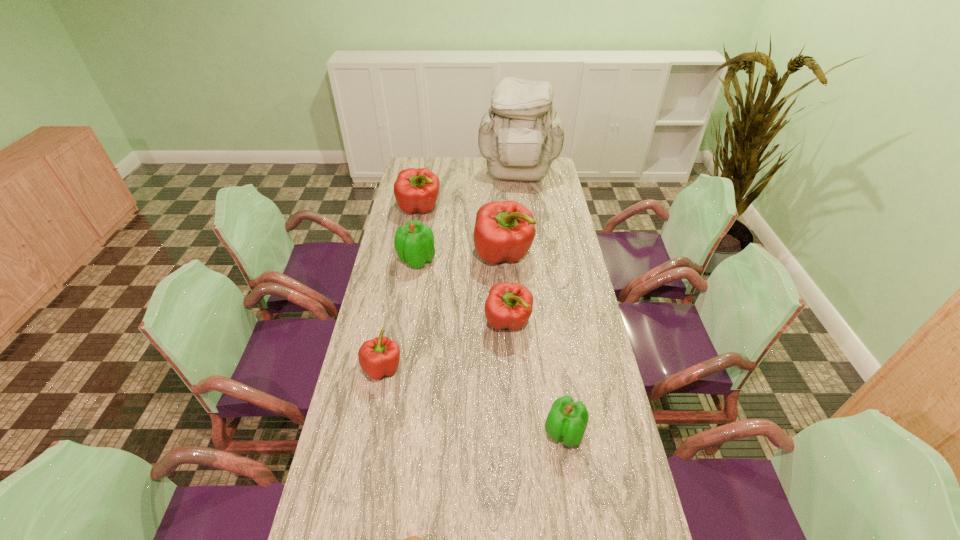
Find the location of a particular element. the farthest object is located at coordinates (521, 134).

In order to click on the tallest object in this screenshot , I will do `click(521, 134)`.

Locate an element on the screen. the seventh shortest object is located at coordinates (504, 231).

Locate an element on the screen. This screenshot has height=540, width=960. the biggest pink bell pepper is located at coordinates (504, 231).

Where is `the farthest pink bell pepper`? Image resolution: width=960 pixels, height=540 pixels. the farthest pink bell pepper is located at coordinates (416, 190).

I want to click on the second farthest object, so click(416, 190).

Locate an element on the screen. The image size is (960, 540). the bigger green bell pepper is located at coordinates (414, 242).

This screenshot has height=540, width=960. What are the coordinates of `the farther green bell pepper` in the screenshot? It's located at (414, 242).

The width and height of the screenshot is (960, 540). I want to click on the fifth farthest object, so click(509, 305).

Where is `the third nearest bell pepper`? This screenshot has width=960, height=540. the third nearest bell pepper is located at coordinates (509, 305).